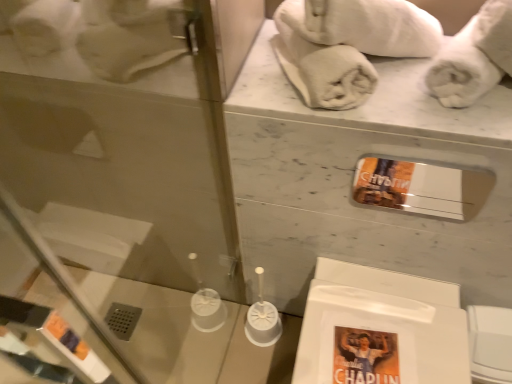
Describe the element at coordinates (119, 160) in the screenshot. I see `transparent glass door at left` at that location.

This screenshot has height=384, width=512. Describe the element at coordinates (351, 42) in the screenshot. I see `white soft towel at upper right, the second bath towel in the right-to-left sequence` at that location.

Locate an element on the screen. This screenshot has width=512, height=384. white soft towel at upper right, the second bath towel when ordered from left to right is located at coordinates click(351, 42).

What is the approximate height of white cotton towel at upper center, which is the 1th bath towel in left-to-right order?

It is 4.41 inches.

Identify the location of transparent glass door at left. (119, 160).

Between transparent glass door at left and white cotton towel at upper center, which is the 1th bath towel in left-to-right order, which one appears on the right side from the viewer's perspective?

white cotton towel at upper center, which is the 1th bath towel in left-to-right order.

From the image's perspective, is transparent glass door at left beneath white cotton towel at upper center, the 3th bath towel positioned from the right?

Indeed, from the image's perspective, transparent glass door at left is shown beneath white cotton towel at upper center, the 3th bath towel positioned from the right.

Is transparent glass door at left surrounding white cotton towel at upper center, which is the 1th bath towel in left-to-right order?

No, white cotton towel at upper center, which is the 1th bath towel in left-to-right order, is not surrounded by transparent glass door at left.

Which point is more forward, [447,102] or [295,72]?

The point [447,102] is more forward.

Considering the relative sizes of white fluffy towel at upper right, acting as the first bath towel starting from the right, and white cotton towel at upper center, the 3th bath towel positioned from the right, in the image provided, is white fluffy towel at upper right, acting as the first bath towel starting from the right, smaller than white cotton towel at upper center, the 3th bath towel positioned from the right,?

Indeed, white fluffy towel at upper right, acting as the first bath towel starting from the right, has a smaller size compared to white cotton towel at upper center, the 3th bath towel positioned from the right.

Who is more distant, white fluffy towel at upper right, acting as the first bath towel starting from the right, or white cotton towel at upper center, which is the 1th bath towel in left-to-right order?

white cotton towel at upper center, which is the 1th bath towel in left-to-right order, is more distant.

From the image's perspective, is white fluffy towel at upper right, acting as the first bath towel starting from the right, below white cotton towel at upper center, which is the 1th bath towel in left-to-right order?

Yes, from the image's perspective, white fluffy towel at upper right, acting as the first bath towel starting from the right, is below white cotton towel at upper center, which is the 1th bath towel in left-to-right order.

How different are the orientations of white fluffy towel at upper right, arranged as the 3th bath towel when viewed from the left, and transparent glass door at left in degrees?

The angle between the facing direction of white fluffy towel at upper right, arranged as the 3th bath towel when viewed from the left, and the facing direction of transparent glass door at left is 124 degrees.

From the image's perspective, which is below, white fluffy towel at upper right, acting as the first bath towel starting from the right, or transparent glass door at left?

transparent glass door at left.

Which of these two, white fluffy towel at upper right, arranged as the 3th bath towel when viewed from the left, or transparent glass door at left, is bigger?

Bigger between the two is transparent glass door at left.

Which is in front, point (482, 66) or point (149, 217)?

The point (482, 66) is closer.

Between white fluffy towel at upper right, acting as the first bath towel starting from the right, and white soft towel at upper right, the second bath towel in the right-to-left sequence, which one appears on the right side from the viewer's perspective?

From the viewer's perspective, white fluffy towel at upper right, acting as the first bath towel starting from the right, appears more on the right side.

From a real-world perspective, is white fluffy towel at upper right, arranged as the 3th bath towel when viewed from the left, on top of white soft towel at upper right, the second bath towel in the right-to-left sequence?

No.

Between white fluffy towel at upper right, arranged as the 3th bath towel when viewed from the left, and white soft towel at upper right, the second bath towel in the right-to-left sequence, which one has larger width?

white fluffy towel at upper right, arranged as the 3th bath towel when viewed from the left.

From the image's perspective, is white soft towel at upper right, the second bath towel in the right-to-left sequence, located above or below white cotton towel at upper center, which is the 1th bath towel in left-to-right order?

white soft towel at upper right, the second bath towel in the right-to-left sequence, is above white cotton towel at upper center, which is the 1th bath towel in left-to-right order.

How much distance is there between white soft towel at upper right, the second bath towel in the right-to-left sequence, and white cotton towel at upper center, which is the 1th bath towel in left-to-right order?

2.96 inches.

Which object is closer to the camera, white soft towel at upper right, the second bath towel when ordered from left to right, or white cotton towel at upper center, which is the 1th bath towel in left-to-right order?

white soft towel at upper right, the second bath towel when ordered from left to right, is in front.

In the scene shown: From a real-world perspective, is white soft towel at upper right, the second bath towel when ordered from left to right, below white cotton towel at upper center, the 3th bath towel positioned from the right?

Actually, white soft towel at upper right, the second bath towel when ordered from left to right, is physically above white cotton towel at upper center, the 3th bath towel positioned from the right, in the real world.

Is point (346, 60) in front of point (308, 79)?

Yes.

From the image's perspective, is white cotton towel at upper center, the 3th bath towel positioned from the right, below white soft towel at upper right, the second bath towel in the right-to-left sequence?

Correct, white cotton towel at upper center, the 3th bath towel positioned from the right, appears lower than white soft towel at upper right, the second bath towel in the right-to-left sequence, in the image.

Does white cotton towel at upper center, which is the 1th bath towel in left-to-right order, have a lesser width compared to white soft towel at upper right, the second bath towel when ordered from left to right?

In fact, white cotton towel at upper center, which is the 1th bath towel in left-to-right order, might be wider than white soft towel at upper right, the second bath towel when ordered from left to right.

How many degrees apart are the facing directions of white cotton towel at upper center, the 3th bath towel positioned from the right, and white soft towel at upper right, the second bath towel when ordered from left to right?

white cotton towel at upper center, the 3th bath towel positioned from the right, and white soft towel at upper right, the second bath towel when ordered from left to right, are facing 22.6 degrees away from each other.

Could you tell me if white soft towel at upper right, the second bath towel when ordered from left to right, is turned towards transparent glass door at left?

No, white soft towel at upper right, the second bath towel when ordered from left to right, is not facing towards transparent glass door at left.

Looking at this image, does white soft towel at upper right, the second bath towel when ordered from left to right, have a lesser height compared to transparent glass door at left?

Indeed, white soft towel at upper right, the second bath towel when ordered from left to right, has a lesser height compared to transparent glass door at left.

Consider the image. Which is farther from the camera, (386, 39) or (231, 248)?

The point (231, 248) is farther from the camera.

The height and width of the screenshot is (384, 512). I want to click on glass door on the left of white cotton towel at upper center, the 3th bath towel positioned from the right, so click(119, 160).

Image resolution: width=512 pixels, height=384 pixels. Find the location of `the 1st bath towel in front of the white cotton towel at upper center, the 3th bath towel positioned from the right`. the 1st bath towel in front of the white cotton towel at upper center, the 3th bath towel positioned from the right is located at coordinates (474, 57).

From the image, which object appears to be nearer to transparent glass door at left, white soft towel at upper right, the second bath towel in the right-to-left sequence, or white cotton towel at upper center, the 3th bath towel positioned from the right?

The object closer to transparent glass door at left is white soft towel at upper right, the second bath towel in the right-to-left sequence.

Looking at the image, which one is located further to transparent glass door at left, white fluffy towel at upper right, arranged as the 3th bath towel when viewed from the left, or white cotton towel at upper center, the 3th bath towel positioned from the right?

white fluffy towel at upper right, arranged as the 3th bath towel when viewed from the left.

When comparing their distances from white soft towel at upper right, the second bath towel when ordered from left to right, does transparent glass door at left or white cotton towel at upper center, the 3th bath towel positioned from the right, seem further?

The object further to white soft towel at upper right, the second bath towel when ordered from left to right, is transparent glass door at left.

When comparing their distances from white fluffy towel at upper right, arranged as the 3th bath towel when viewed from the left, does white soft towel at upper right, the second bath towel in the right-to-left sequence, or transparent glass door at left seem closer?

Among the two, white soft towel at upper right, the second bath towel in the right-to-left sequence, is located nearer to white fluffy towel at upper right, arranged as the 3th bath towel when viewed from the left.

Which object lies nearer to the anchor point white fluffy towel at upper right, acting as the first bath towel starting from the right, white cotton towel at upper center, which is the 1th bath towel in left-to-right order, or transparent glass door at left?

white cotton towel at upper center, which is the 1th bath towel in left-to-right order, is closer to white fluffy towel at upper right, acting as the first bath towel starting from the right.

Based on their spatial positions, is white cotton towel at upper center, the 3th bath towel positioned from the right, or white fluffy towel at upper right, acting as the first bath towel starting from the right, closer to transparent glass door at left?

Based on the image, white cotton towel at upper center, the 3th bath towel positioned from the right, appears to be nearer to transparent glass door at left.

When comparing their distances from transparent glass door at left, does white fluffy towel at upper right, arranged as the 3th bath towel when viewed from the left, or white soft towel at upper right, the second bath towel when ordered from left to right, seem closer?

Based on the image, white soft towel at upper right, the second bath towel when ordered from left to right, appears to be nearer to transparent glass door at left.

Based on their spatial positions, is white fluffy towel at upper right, arranged as the 3th bath towel when viewed from the left, or transparent glass door at left further from white soft towel at upper right, the second bath towel when ordered from left to right?

transparent glass door at left lies further to white soft towel at upper right, the second bath towel when ordered from left to right, than the other object.

Locate an element on the screen. bath towel situated between white cotton towel at upper center, which is the 1th bath towel in left-to-right order, and white fluffy towel at upper right, arranged as the 3th bath towel when viewed from the left, from left to right is located at coordinates pyautogui.click(x=351, y=42).